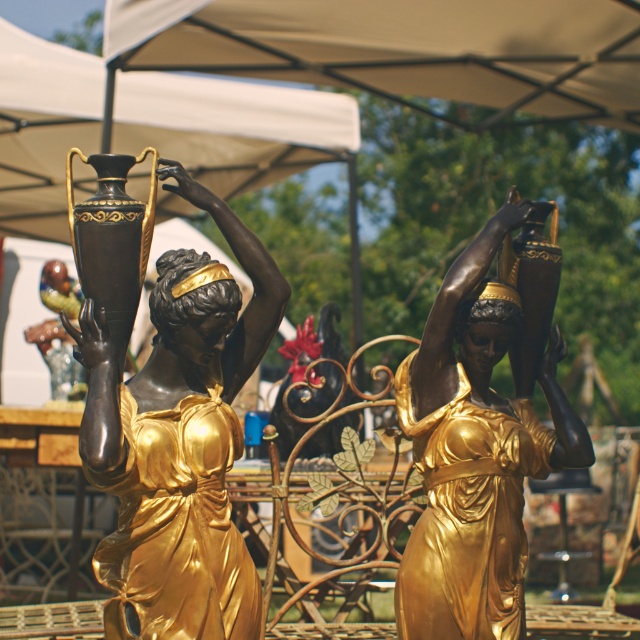
Measure the distance between gold-bronze head at center and gold polished statue head at center.

gold-bronze head at center and gold polished statue head at center are 4.16 feet apart from each other.

Is gold-bronze head at center above gold polished statue head at center?

Yes, gold-bronze head at center is above gold polished statue head at center.

Which is in front, point (161, 280) or point (470, 321)?

Point (161, 280) is in front.

Find the location of a particular element. Image resolution: width=640 pixels, height=640 pixels. gold-bronze head at center is located at coordinates click(x=188, y=292).

Can you confirm if gold-bronze statue at center is positioned below gold polished statue head at center?

Indeed, gold-bronze statue at center is positioned under gold polished statue head at center.

What do you see at coordinates (179, 438) in the screenshot? I see `gold-bronze statue at center` at bounding box center [179, 438].

You are a GUI agent. You are given a task and a screenshot of the screen. Output one action in this format:
    pyautogui.click(x=<x>, y=<y>)
    Task: Click on the gold-bronze statue at center
    
    Given the screenshot: What is the action you would take?
    pyautogui.click(x=179, y=438)

Who is taller, gold-bronze statue at center or gold-bronze head at center?

With more height is gold-bronze statue at center.

Find the location of a particular element. The width and height of the screenshot is (640, 640). gold-bronze statue at center is located at coordinates (179, 438).